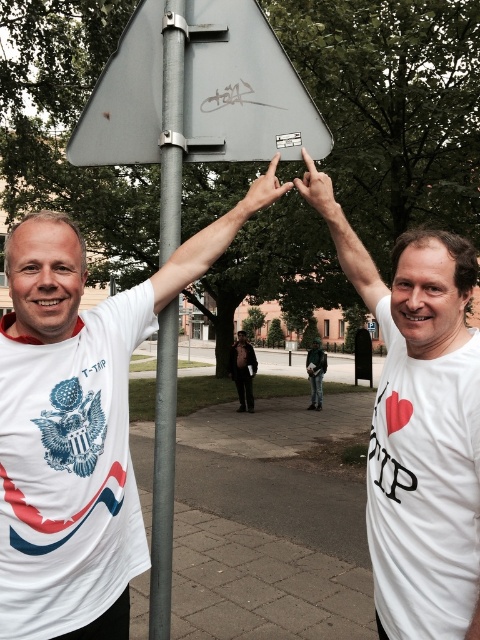
Does white matte t-shirt at upper center lie in front of dark gray suit at center?

Yes, white matte t-shirt at upper center is closer to the viewer.

Which of these two, white matte t-shirt at upper center or dark gray suit at center, stands taller?

With more height is dark gray suit at center.

Find the location of a particular element. white matte t-shirt at upper center is located at coordinates click(422, 436).

Which is behind, point (140, 328) or point (317, 179)?

Point (317, 179)

Locate an element on the screen. This screenshot has height=640, width=480. white matte t-shirt at upper left is located at coordinates (72, 428).

Between white matte t-shirt at upper center and matte gray sign at center, which one is positioned lower?

white matte t-shirt at upper center is lower down.

How much distance is there between white matte t-shirt at upper center and matte gray sign at center?

A distance of 68.67 centimeters exists between white matte t-shirt at upper center and matte gray sign at center.

Image resolution: width=480 pixels, height=640 pixels. In order to click on white matte t-shirt at upper center in this screenshot , I will do `click(422, 436)`.

The width and height of the screenshot is (480, 640). I want to click on white matte t-shirt at upper center, so click(x=422, y=436).